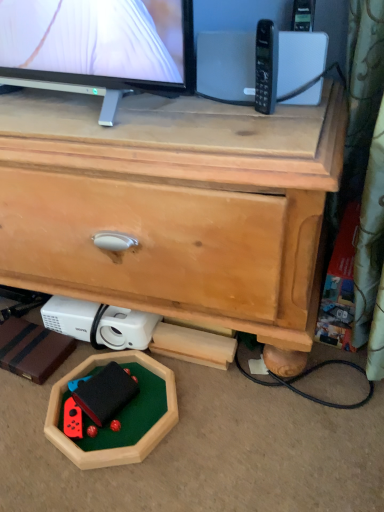
Find the location of a particular element. Image resolution: width=384 pixels, height=512 pixels. vacant region in front of black plastic phone at upper right is located at coordinates (261, 136).